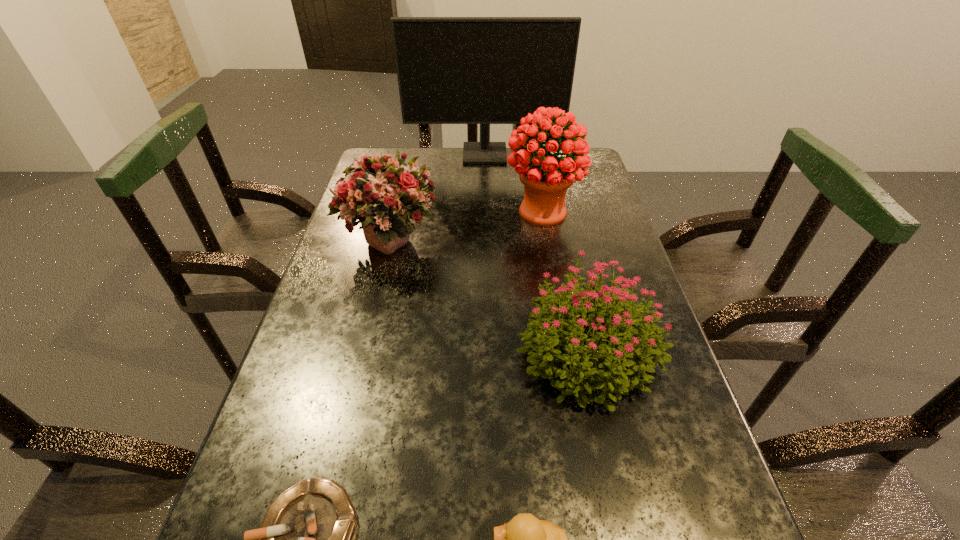
The height and width of the screenshot is (540, 960). I want to click on free area in between the leftmost bouquet and the fifth shortest object, so click(x=466, y=226).

This screenshot has height=540, width=960. Find the location of `vacant area that lies between the leftmost bouquet and the nearest bouquet`. vacant area that lies between the leftmost bouquet and the nearest bouquet is located at coordinates (489, 295).

At what (x,y) coordinates should I click in order to perform the action: click on object that stands as the fifth closest to the second tallest object. Please return your answer as a coordinate pair (x, y). Looking at the image, I should click on (525, 539).

I want to click on the fifth closest object to the nearest bouquet, so click(x=451, y=70).

Find the location of a particular element. The image size is (960, 540). bouquet identified as the closest to the farthest object is located at coordinates (546, 179).

The height and width of the screenshot is (540, 960). In order to click on bouquet that is the closest to the computer monitor in this screenshot , I will do `click(546, 179)`.

Locate an element on the screen. vacant space that satisfies the following two spatial constraints: 1. on the front-facing side of the tallest object; 2. on the right side of the fifth shortest object is located at coordinates (486, 212).

Locate an element on the screen. vacant region that satisfies the following two spatial constraints: 1. on the front-facing side of the farthest object; 2. on the left side of the tallest bouquet is located at coordinates (486, 212).